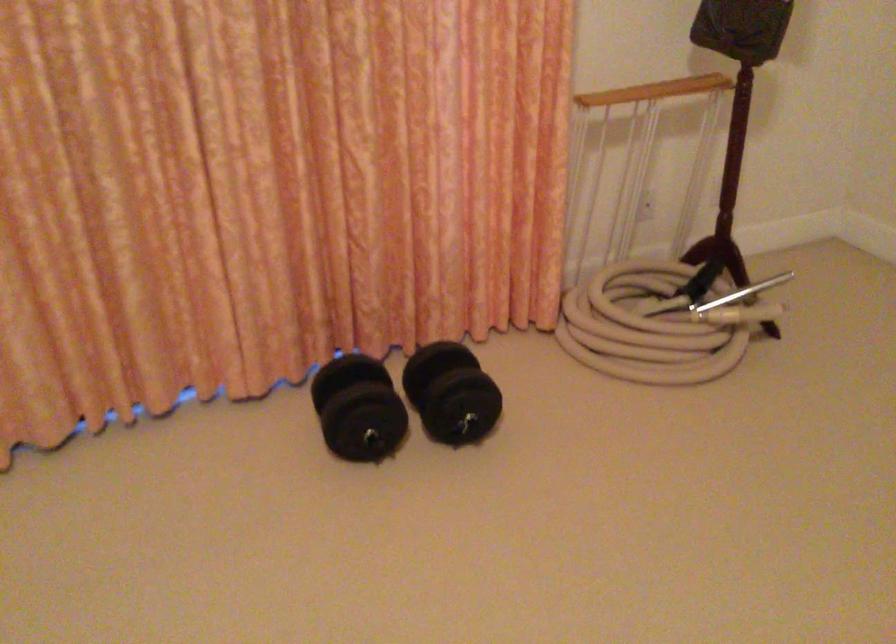
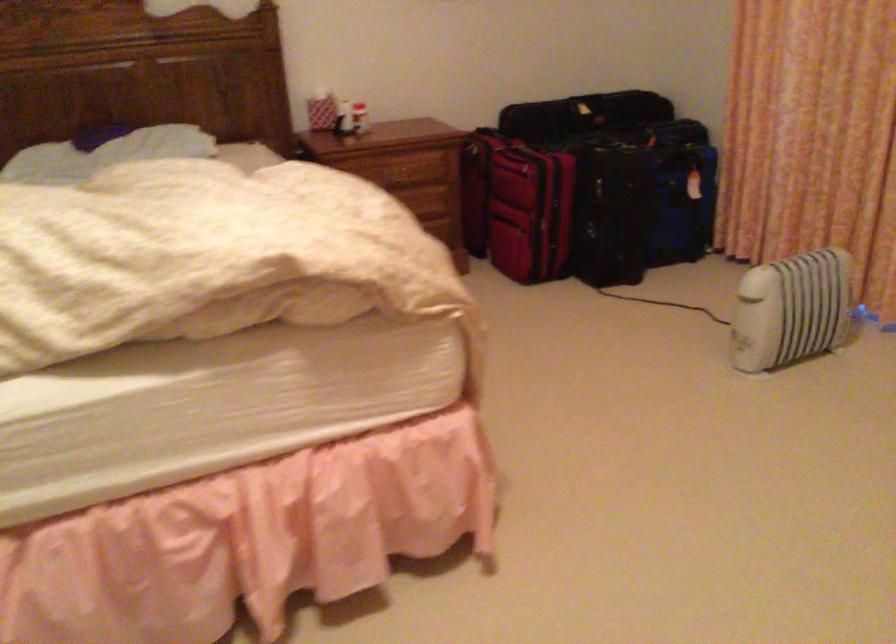
The images are taken continuously from a first-person perspective. In which direction is your viewpoint rotating?

The camera rotated toward left-down.